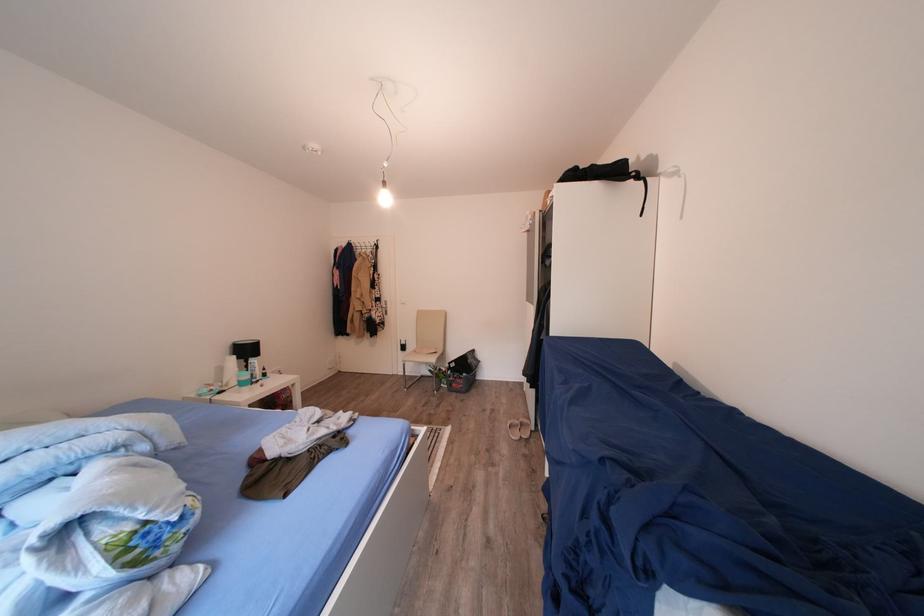
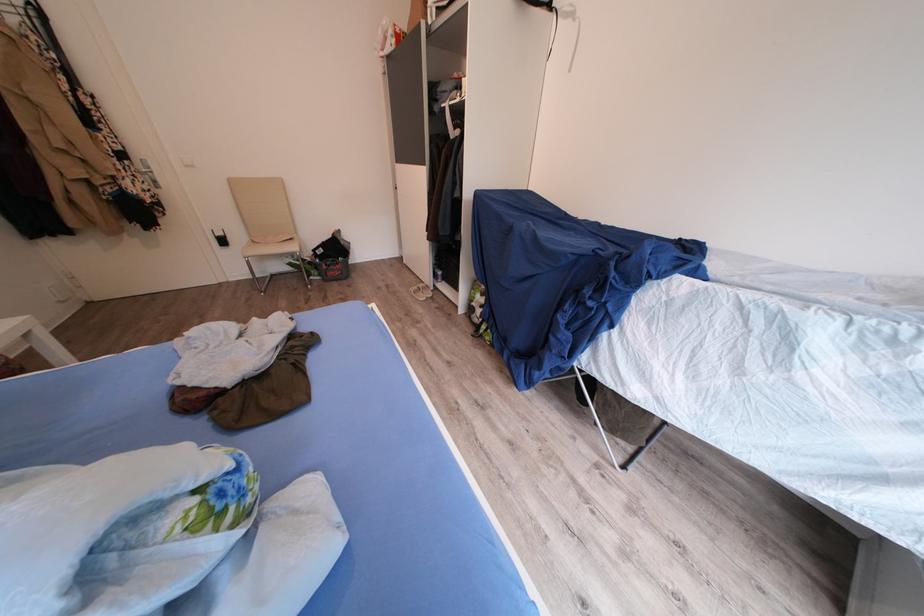
The point at [386,305] is marked in the first image. Where is the corresponding point in the second image?

(130, 161)